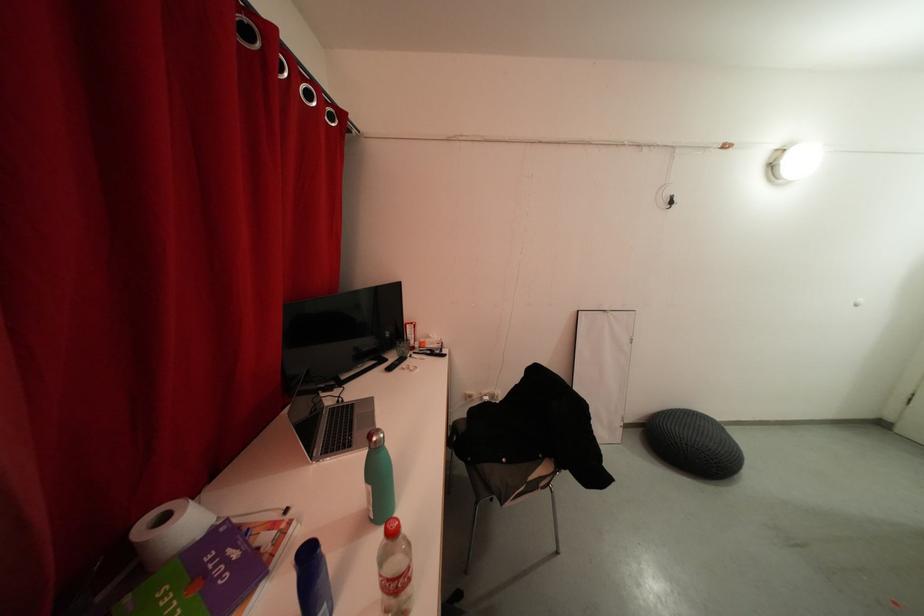
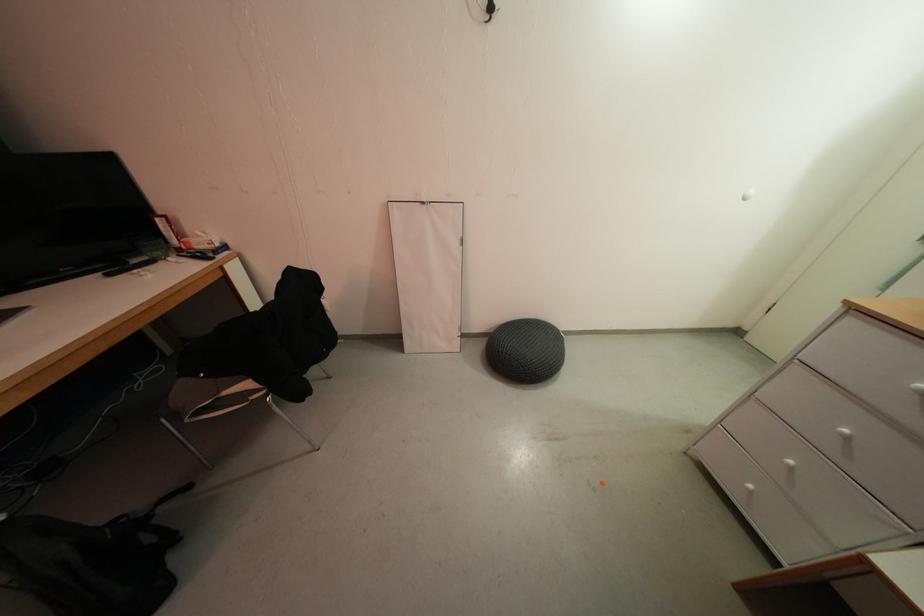
Question: Which direction would the cameraman need to move to produce the second image? Reply with the corresponding letter.

Choices:
 (A) Left
 (B) Right
 (C) Forward
 (D) Backward

Answer: (B)